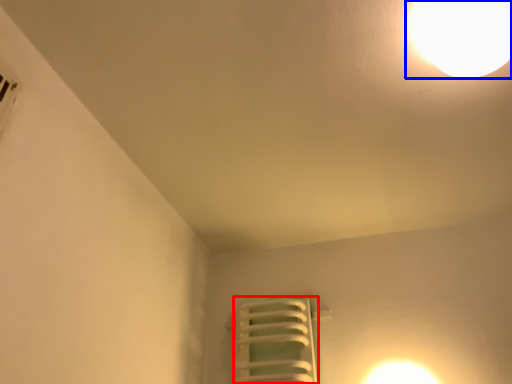
Question: Which object is closer to the camera taking this photo, radiator (highlighted by a red box) or lamp (highlighted by a blue box)?

Choices:
 (A) radiator
 (B) lamp

Answer: (B)